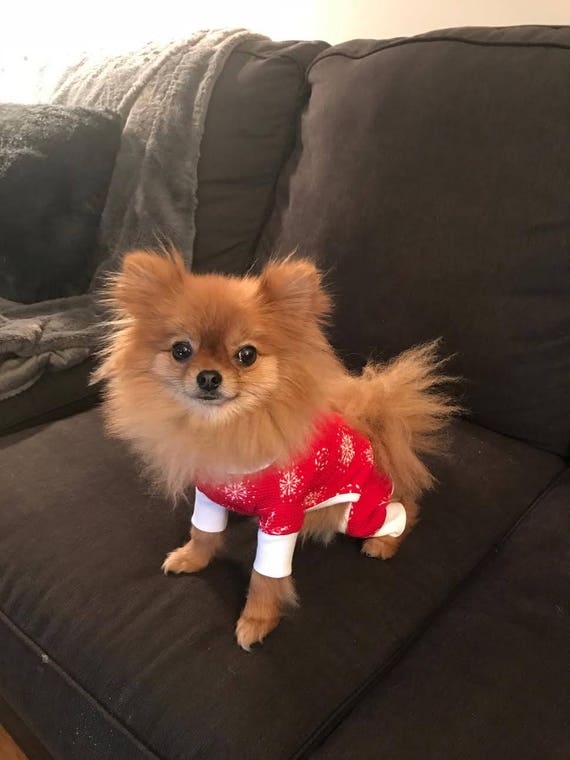
At what (x,y) coordinates should I click in order to perform the action: click on pillow. Please return your answer as a coordinate pair (x, y). The image size is (570, 760). Looking at the image, I should click on (61, 176).